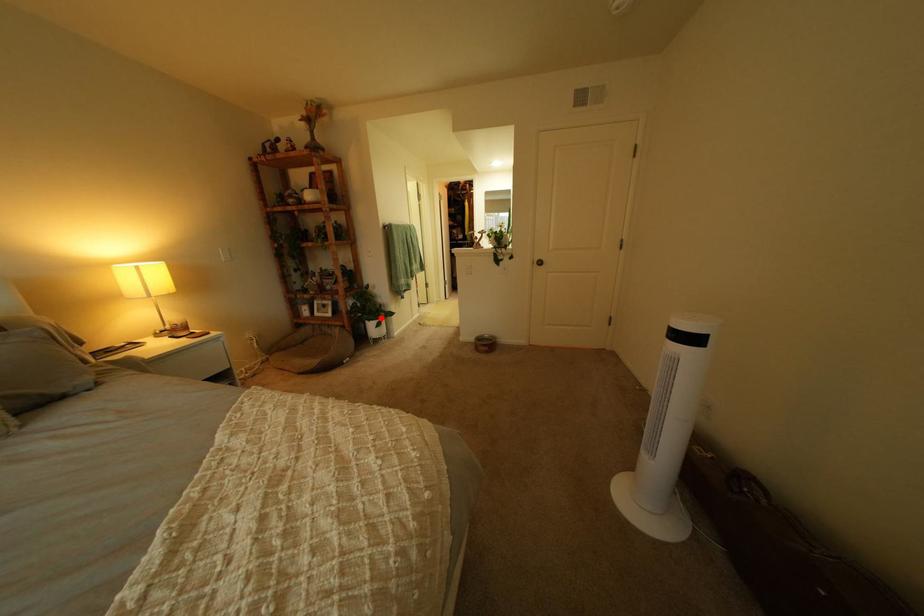
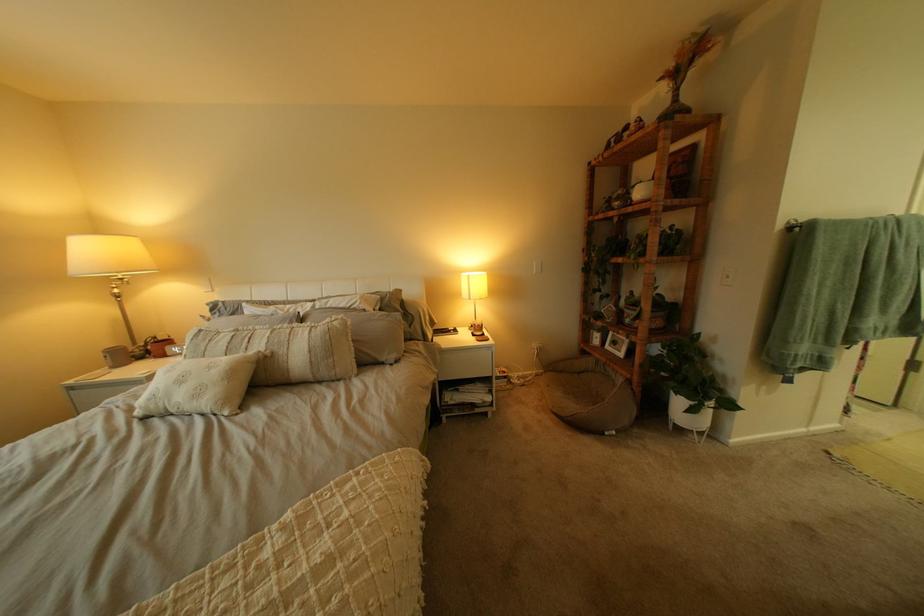
Locate, in the second image, the point that corresponds to the highlighted location in the first image.

(687, 385)